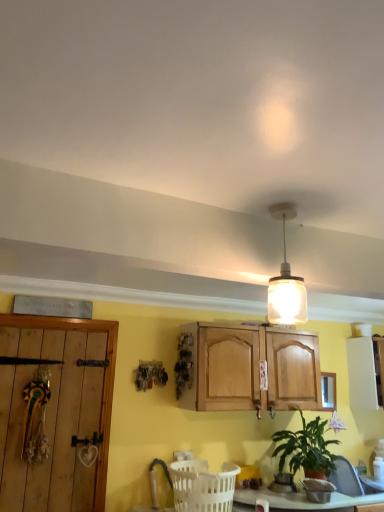
This screenshot has height=512, width=384. In order to click on clear glass window at upper right in this screenshot , I will do `click(328, 391)`.

What do you see at coordinates (306, 448) in the screenshot? I see `green matte plant at lower right` at bounding box center [306, 448].

The width and height of the screenshot is (384, 512). In order to click on green matte plant at lower right in this screenshot , I will do `click(306, 448)`.

In order to face white matte cabinet at right, should I rotate leftwards or rightwards?

Rotate your view right by about 24.630°.

Identify the location of clear glass window at upper right. This screenshot has width=384, height=512. (328, 391).

Looking at this image, can white matte cabinet at right be found inside clear glass window at upper right?

No, white matte cabinet at right is not a part of clear glass window at upper right.

Does clear glass window at upper right have a lesser width compared to white matte cabinet at right?

Yes.

From their relative heights in the image, would you say clear glass window at upper right is taller or shorter than white matte cabinet at right?

Considering their sizes, clear glass window at upper right has less height than white matte cabinet at right.

How different are the orientations of clear glass window at upper right and white matte cabinet at right in degrees?

clear glass window at upper right and white matte cabinet at right are facing 1.4 degrees away from each other.

Can you tell me how much white matte cabinet at right and translucent glass pendant light at upper center differ in facing direction?

There is a 1.41-degree angle between the facing directions of white matte cabinet at right and translucent glass pendant light at upper center.

From the image's perspective, which one is positioned lower, white matte cabinet at right or translucent glass pendant light at upper center?

white matte cabinet at right, from the image's perspective.

Would you say white matte cabinet at right is outside translucent glass pendant light at upper center?

That's correct, white matte cabinet at right is outside of translucent glass pendant light at upper center.

How many degrees apart are the facing directions of white plastic basket at lower center and translucent glass pendant light at upper center?

0.00252 degrees.

Is point (176, 466) farther from viewer compared to point (285, 283)?

Yes, it is behind point (285, 283).

From a real-world perspective, is white plastic basket at lower center over translucent glass pendant light at upper center?

No, from a real-world perspective, white plastic basket at lower center is not over translucent glass pendant light at upper center

Considering the positions of objects white plastic basket at lower center and translucent glass pendant light at upper center in the image provided, who is more to the right, white plastic basket at lower center or translucent glass pendant light at upper center?

From the viewer's perspective, translucent glass pendant light at upper center appears more on the right side.

Can you confirm if green matte plant at lower right is wider than translucent glass pendant light at upper center?

Correct, the width of green matte plant at lower right exceeds that of translucent glass pendant light at upper center.

Which is more to the left, green matte plant at lower right or translucent glass pendant light at upper center?

From the viewer's perspective, translucent glass pendant light at upper center appears more on the left side.

Can you confirm if green matte plant at lower right is smaller than translucent glass pendant light at upper center?

No.

Would you say green matte plant at lower right is a long distance from translucent glass pendant light at upper center?

Yes, green matte plant at lower right and translucent glass pendant light at upper center are located far from each other.

Can you confirm if translucent glass pendant light at upper center is bigger than green matte plant at lower right?

Actually, translucent glass pendant light at upper center might be smaller than green matte plant at lower right.

Is green matte plant at lower right located within translucent glass pendant light at upper center?

No.

Does translucent glass pendant light at upper center lie behind green matte plant at lower right?

No, it is not.

Is translucent glass pendant light at upper center with white matte cabinet at right?

translucent glass pendant light at upper center is not next to white matte cabinet at right, and they're not touching.

Who is more distant, translucent glass pendant light at upper center or white matte cabinet at right?

white matte cabinet at right is further away from the camera.

From their relative heights in the image, would you say translucent glass pendant light at upper center is taller or shorter than white matte cabinet at right?

In the image, translucent glass pendant light at upper center appears to be shorter than white matte cabinet at right.

Who is bigger, translucent glass pendant light at upper center or white matte cabinet at right?

With larger size is white matte cabinet at right.

Which of these two, white plastic basket at lower center or green matte plant at lower right, is bigger?

green matte plant at lower right.

Is white plastic basket at lower center positioned before green matte plant at lower right?

Yes, white plastic basket at lower center is in front of green matte plant at lower right.

From a real-world perspective, relative to green matte plant at lower right, is white plastic basket at lower center vertically above or below?

Clearly, from a real-world perspective, white plastic basket at lower center is below green matte plant at lower right.

From the image's perspective, relative to green matte plant at lower right, is white plastic basket at lower center above or below?

Clearly, from the image's perspective, white plastic basket at lower center is below green matte plant at lower right.

Image resolution: width=384 pixels, height=512 pixels. In order to click on cabinetry above the clear glass window at upper right (from a real-world perspective) in this screenshot , I will do `click(361, 373)`.

I want to click on cabinetry lying behind the translucent glass pendant light at upper center, so click(361, 373).

Which object lies further to the anchor point clear glass window at upper right, green matte plant at lower right or translucent glass pendant light at upper center?

translucent glass pendant light at upper center is positioned further to the anchor clear glass window at upper right.

Which object lies further to the anchor point white plastic basket at lower center, clear glass window at upper right or translucent glass pendant light at upper center?

translucent glass pendant light at upper center is positioned further to the anchor white plastic basket at lower center.

Which object lies nearer to the anchor point clear glass window at upper right, white plastic basket at lower center or white matte cabinet at right?

white matte cabinet at right lies closer to clear glass window at upper right than the other object.

Based on their spatial positions, is white matte cabinet at right or white plastic basket at lower center further from green matte plant at lower right?

white matte cabinet at right.

Based on their spatial positions, is green matte plant at lower right or translucent glass pendant light at upper center further from white matte cabinet at right?

translucent glass pendant light at upper center.

From the image, which object appears to be farther from translucent glass pendant light at upper center, green matte plant at lower right or white matte cabinet at right?

white matte cabinet at right lies further to translucent glass pendant light at upper center than the other object.

Looking at the image, which one is located closer to white plastic basket at lower center, clear glass window at upper right or green matte plant at lower right?

green matte plant at lower right is positioned closer to the anchor white plastic basket at lower center.

Which object lies nearer to the anchor point white plastic basket at lower center, green matte plant at lower right or clear glass window at upper right?

green matte plant at lower right is closer to white plastic basket at lower center.

Identify the location of window between white plastic basket at lower center and white matte cabinet at right in the horizontal direction. The height and width of the screenshot is (512, 384). (328, 391).

You are a GUI agent. You are given a task and a screenshot of the screen. Output one action in this format:
    pyautogui.click(x=<x>, y=<y>)
    Task: Click on the cabinetry positioned between green matte plant at lower right and clear glass window at upper right from near to far
    This screenshot has height=512, width=384.
    Given the screenshot: What is the action you would take?
    pyautogui.click(x=361, y=373)

I want to click on houseplant between white plastic basket at lower center and white matte cabinet at right in the horizontal direction, so click(306, 448).

The height and width of the screenshot is (512, 384). In order to click on houseplant positioned between white plastic basket at lower center and clear glass window at upper right from near to far in this screenshot , I will do `click(306, 448)`.